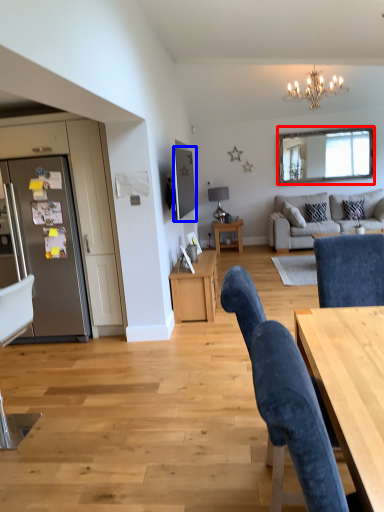
Question: Which point is closer to the camera, mirror (highlighted by a red box) or television (highlighted by a blue box)?

Choices:
 (A) mirror
 (B) television

Answer: (B)